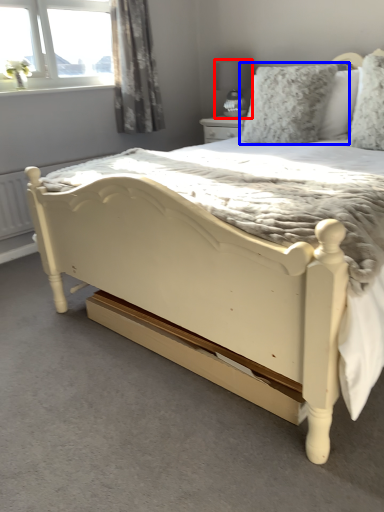
Question: Which of the following is the farthest to the observer, lamp (highlighted by a red box) or pillow (highlighted by a blue box)?

Choices:
 (A) lamp
 (B) pillow

Answer: (A)